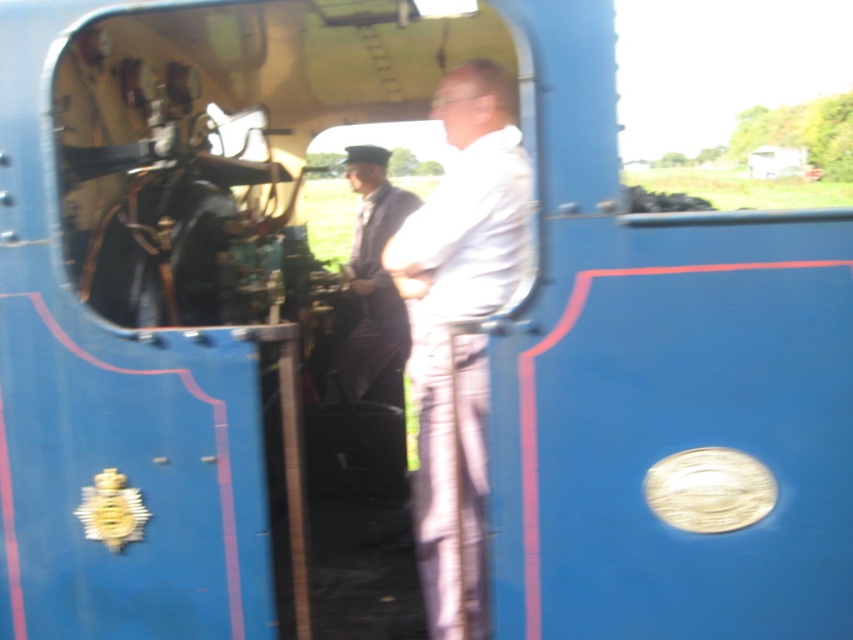
You are a passenger in the steam locomotive cab. You notice two people inside. Which person is standing closer to the floor, the one wearing the white matte shirt at center or the dark blue uniform at center?

The white matte shirt at center is below dark blue uniform at center, so the person wearing the white matte shirt at center is standing closer to the floor.

You are designing a new uniform for the train crew. Based on the image, which uniform has a wider design between the white matte shirt at center and the dark blue uniform at center?

The dark blue uniform at center has a wider design than the white matte shirt at center, as the white matte shirt at center is narrower.

You are a maintenance worker needing to access a control panel located behind the dark blue uniform at center. The white matte shirt at center is blocking your path. Can you move around them to reach the control panel?

The white matte shirt at center is closer to the viewer than the dark blue uniform at center, so you can move around them to access the control panel behind the dark blue uniform at center.